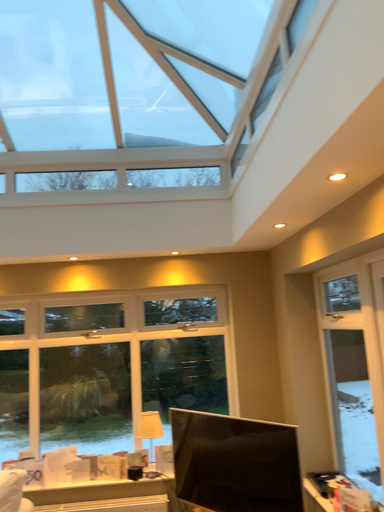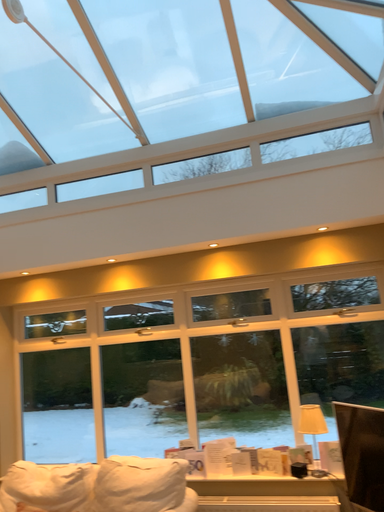
Question: How did the camera likely rotate when shooting the video?

Choices:
 (A) rotated left
 (B) rotated right

Answer: (A)